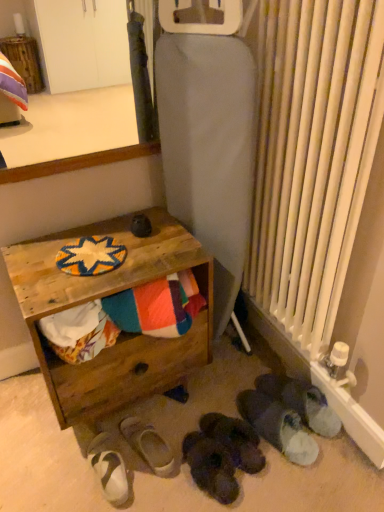
Where is `vacant area on the back side of dark gray suede slippers at lower center, the 4th footwear viewed from the right`? vacant area on the back side of dark gray suede slippers at lower center, the 4th footwear viewed from the right is located at coordinates (190, 408).